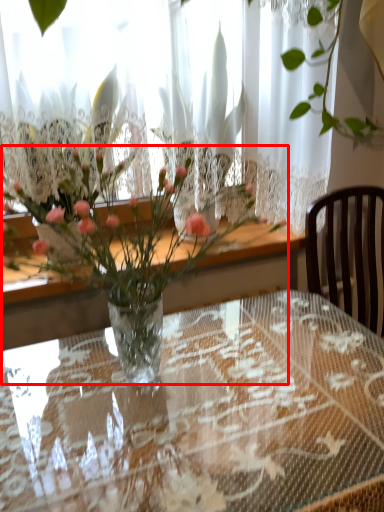
Question: Observing the image, what is the correct spatial positioning of bouquet (annotated by the red box) in reference to table?

Choices:
 (A) left
 (B) right

Answer: (A)